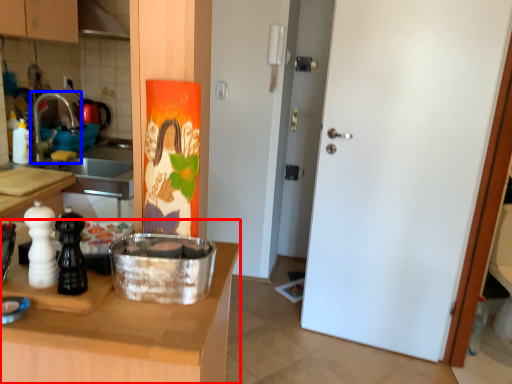
Question: Among these objects, which one is nearest to the camera, countertop (highlighted by a red box) or faucet (highlighted by a blue box)?

Choices:
 (A) countertop
 (B) faucet

Answer: (A)